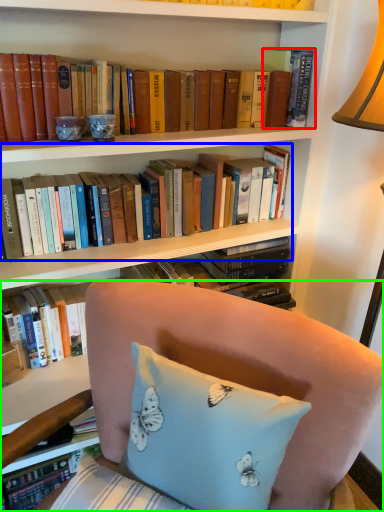
Question: Which object is positioned farthest from book (highlighted by a red box)? Select from book (highlighted by a blue box) and chair (highlighted by a green box).

Choices:
 (A) book
 (B) chair

Answer: (B)